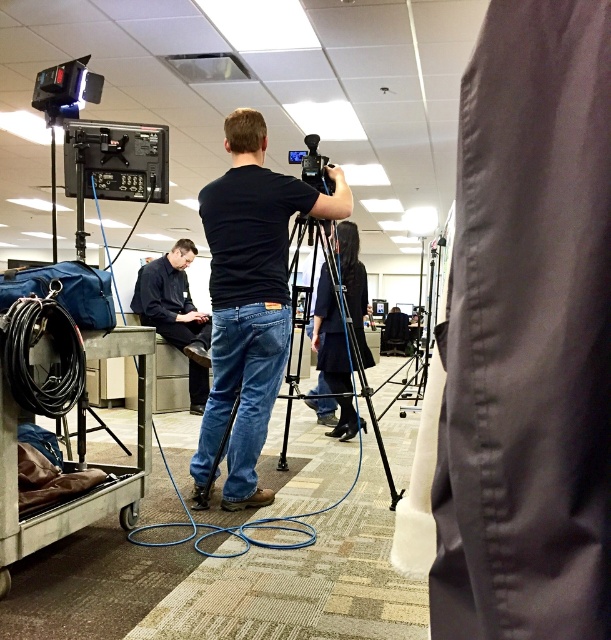
Question: Which is nearer to the black matte video camera at center?

Choices:
 (A) black rubber cart at lower left
 (B) black shirt at left
 (C) black matte camera at center
 (D) black metal tripod at center

Answer: (C)

Question: Is black rubber cart at lower left to the right of black shirt at left from the viewer's perspective?

Choices:
 (A) yes
 (B) no

Answer: (A)

Question: Based on their relative distances, which object is nearer to the black shirt at left?

Choices:
 (A) black metal tripod at center
 (B) dark blue jeans at center
 (C) black rubber cart at lower left
 (D) black matte video camera at center

Answer: (B)

Question: Which point is farther to the camera?

Choices:
 (A) (257, 358)
 (B) (199, 381)
 (C) (351, 280)

Answer: (B)

Question: Is black matte camera at center thinner than black rubber cart at lower left?

Choices:
 (A) yes
 (B) no

Answer: (B)

Question: Does black matte camera at center have a larger size compared to dark blue jeans at center?

Choices:
 (A) yes
 (B) no

Answer: (B)